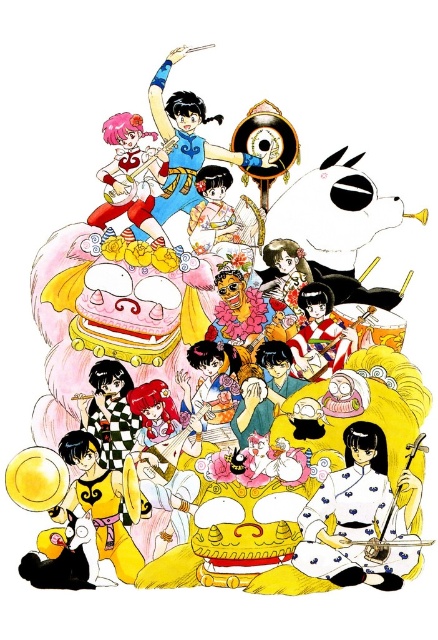
You are a photographer standing at the back of the scene. You want to capture a photo that includes both the blue silk kimono at upper center and the matte white dress at upper left. Given their positions, do you think you can fit both into your camera frame without moving your position?

The blue silk kimono at upper center and the matte white dress at upper left are 30.53 inches apart from each other. Since the distance between them is fixed, you can adjust your camera angle or zoom to include both in the frame without moving your position.

In the festive scene with the dragon head, there are two characters wearing a blue silk kimono at upper center and a matte white dress at upper left. Which character is wearing a larger garment?

The blue silk kimono at upper center is bigger than the matte white dress at upper left, so the character wearing the blue silk kimono at upper center has the larger garment.